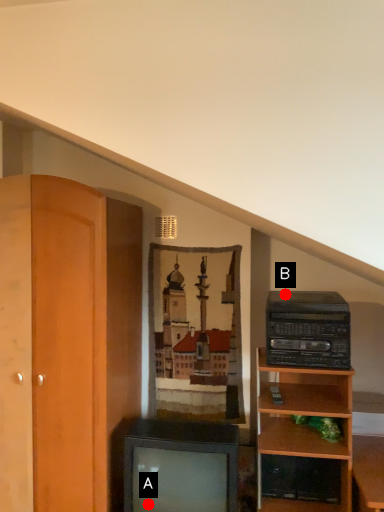
Question: Two points are circled on the image, labeled by A and B beside each circle. Which point is closer to the camera?

Choices:
 (A) A is closer
 (B) B is closer

Answer: (A)